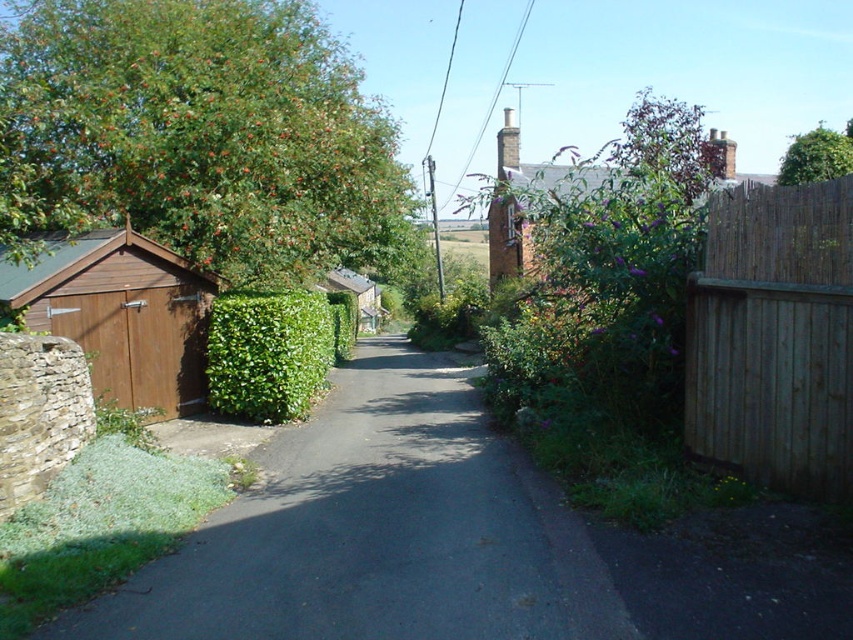
You are standing at the center of the road in the countryside scene. You want to walk to the brown wooden fence at right. Which direction should you move?

You should move to the right to reach the brown wooden fence at right since it is located on the right side of the road.

You are a painter standing at the edge of the road and want to capture the brown wooden fence at right and the green leafy tree at upper right in your painting. Which object should you focus on first if you want to paint the closer one first?

The brown wooden fence at right is closer to the viewer than the green leafy tree at upper right, so you should focus on painting the brown wooden fence at right first.